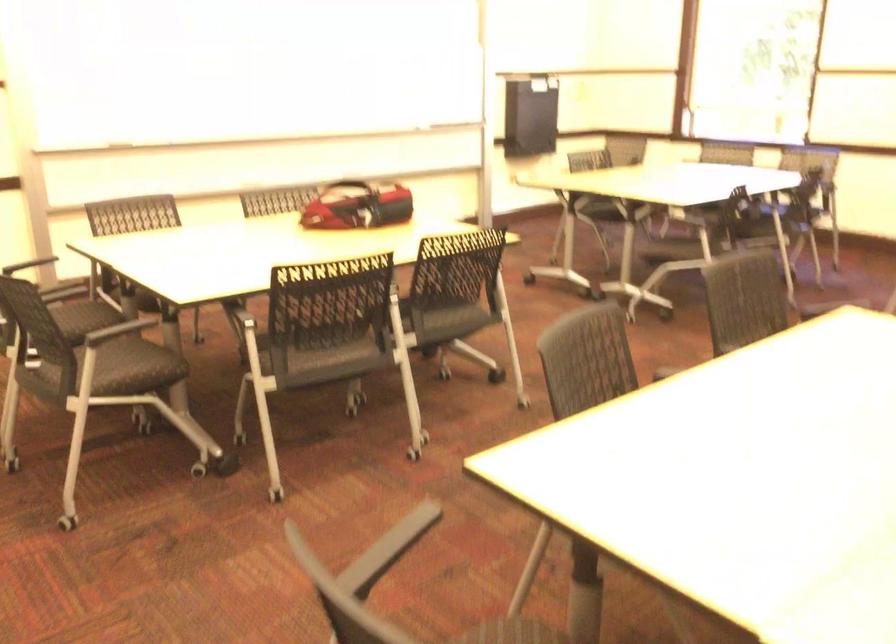
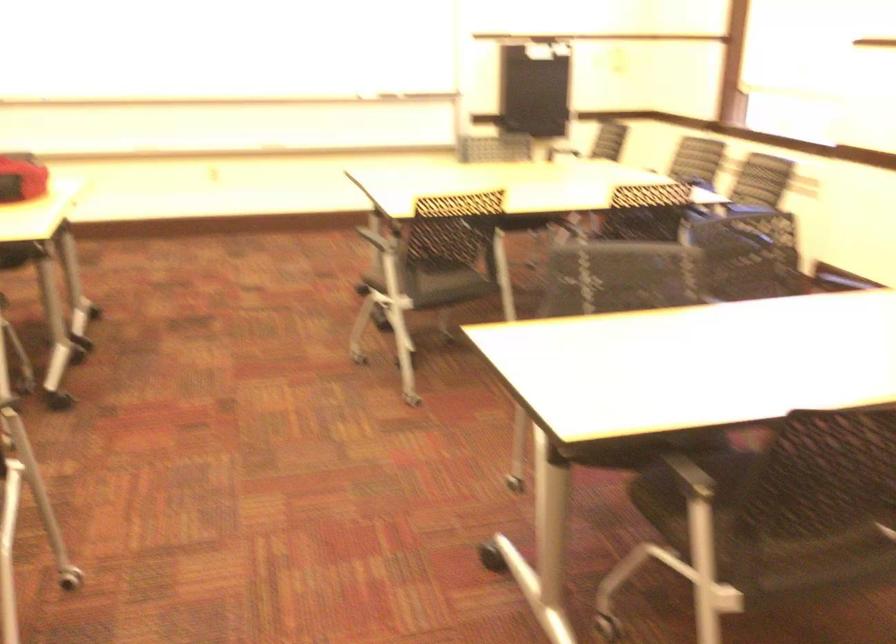
In a continuous first-person perspective shot, in which direction is the camera moving?

The movement direction of the cameraman is right, forward.